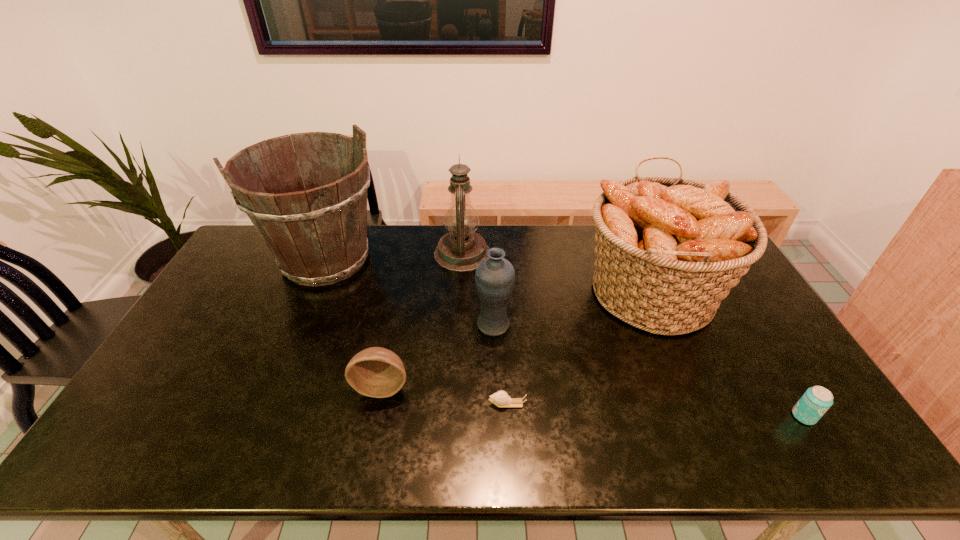
Where is `free space located on the left of the basket`? This screenshot has width=960, height=540. free space located on the left of the basket is located at coordinates (505, 292).

This screenshot has width=960, height=540. Find the location of `vacant region located on the left of the vase`. vacant region located on the left of the vase is located at coordinates (429, 325).

Locate an element on the screen. free space located 0.230m on the left of the sixth object from right to left is located at coordinates (266, 386).

Where is `free space located 0.070m on the back of the second shortest object`? Image resolution: width=960 pixels, height=540 pixels. free space located 0.070m on the back of the second shortest object is located at coordinates (783, 383).

I want to click on vacant space located 0.180m on the shell of the shortest object, so click(418, 403).

At what (x,y) coordinates should I click in order to perform the action: click on free spot located 0.090m on the shell of the shortest object. Please return your answer as a coordinate pair (x, y). This screenshot has height=540, width=960. Looking at the image, I should click on (453, 403).

The image size is (960, 540). Find the location of `vacant space situated on the shell of the shortest object`. vacant space situated on the shell of the shortest object is located at coordinates (363, 403).

Where is `bucket at the far edge`? This screenshot has width=960, height=540. bucket at the far edge is located at coordinates (318, 236).

At what (x,y) coordinates should I click in order to perform the action: click on oil lamp positioned at the far edge. Please return your answer as a coordinate pair (x, y). The height and width of the screenshot is (540, 960). Looking at the image, I should click on (461, 250).

The image size is (960, 540). Identify the location of basket present at the far edge. (668, 250).